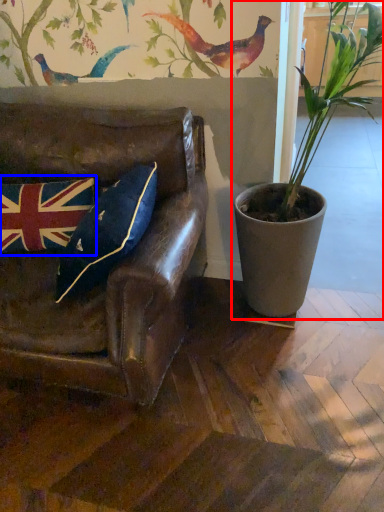
Question: Which of the following is the farthest to the observer, houseplant (highlighted by a red box) or flag (highlighted by a blue box)?

Choices:
 (A) houseplant
 (B) flag

Answer: (B)